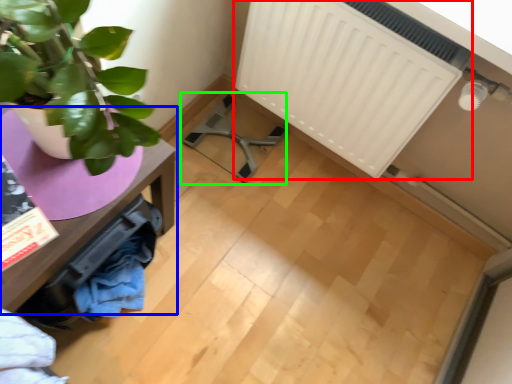
Question: Based on their relative distances, which object is farther from radiator (highlighted by a red box)? Choose from table (highlighted by a blue box) and swivel chair (highlighted by a green box).

Choices:
 (A) table
 (B) swivel chair

Answer: (A)